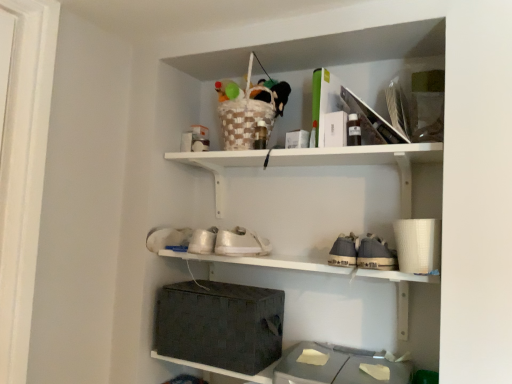
Question: Does white matte shoe at lower left, which is the 2th shoe from right to left, appear on the right side of woven fabric basket at center, which appears as the 1th shelf when ordered from the bottom?

Choices:
 (A) no
 (B) yes

Answer: (A)

Question: Could you tell me if white matte shoe at lower left, the first shoe in the left-to-right sequence, is turned towards woven fabric basket at center, which appears as the 1th shelf when ordered from the bottom?

Choices:
 (A) no
 (B) yes

Answer: (A)

Question: Can you confirm if white matte shoe at lower left, which is the 2th shoe from right to left, is smaller than woven fabric basket at center, which ranks as the 2th shelf in top-to-bottom order?

Choices:
 (A) no
 (B) yes

Answer: (B)

Question: Does white matte shoe at lower left, the first shoe in the left-to-right sequence, touch woven fabric basket at center, which appears as the 1th shelf when ordered from the bottom?

Choices:
 (A) yes
 (B) no

Answer: (B)

Question: From a real-world perspective, is white matte shoe at lower left, which is the 2th shoe from right to left, on woven fabric basket at center, which ranks as the 2th shelf in top-to-bottom order?

Choices:
 (A) no
 (B) yes

Answer: (B)

Question: Does white matte shoe at lower left, which is the 2th shoe from right to left, have a lesser width compared to woven fabric basket at center, which appears as the 1th shelf when ordered from the bottom?

Choices:
 (A) no
 (B) yes

Answer: (A)

Question: Can you confirm if woven fabric storage box at lower center, positioned as the first storage box in left-to-right order, is shorter than white matte shoe at lower left, which is the 2th shoe from right to left?

Choices:
 (A) no
 (B) yes

Answer: (A)

Question: Considering the relative sizes of woven fabric storage box at lower center, positioned as the first storage box in left-to-right order, and white matte shoe at lower left, the first shoe in the left-to-right sequence, in the image provided, is woven fabric storage box at lower center, positioned as the first storage box in left-to-right order, bigger than white matte shoe at lower left, the first shoe in the left-to-right sequence,?

Choices:
 (A) yes
 (B) no

Answer: (A)

Question: Is woven fabric storage box at lower center, the 2th storage box in the right-to-left sequence, in contact with white matte shoe at lower left, the first shoe in the left-to-right sequence?

Choices:
 (A) no
 (B) yes

Answer: (A)

Question: Considering the relative sizes of woven fabric storage box at lower center, the 2th storage box in the right-to-left sequence, and white matte shoe at lower left, the first shoe in the left-to-right sequence, in the image provided, is woven fabric storage box at lower center, the 2th storage box in the right-to-left sequence, thinner than white matte shoe at lower left, the first shoe in the left-to-right sequence,?

Choices:
 (A) yes
 (B) no

Answer: (B)

Question: Is woven fabric storage box at lower center, positioned as the first storage box in left-to-right order, to the left of white matte shoe at lower left, the first shoe in the left-to-right sequence, from the viewer's perspective?

Choices:
 (A) yes
 (B) no

Answer: (B)

Question: Can you confirm if woven fabric storage box at lower center, the 2th storage box in the right-to-left sequence, is taller than white matte shoe at lower left, which is the 2th shoe from right to left?

Choices:
 (A) yes
 (B) no

Answer: (A)

Question: Considering the relative sizes of white matte shelf at upper center, the first shelf positioned from the top, and white matte shoe at lower left, which is the 2th shoe from right to left, in the image provided, is white matte shelf at upper center, the first shelf positioned from the top, shorter than white matte shoe at lower left, which is the 2th shoe from right to left,?

Choices:
 (A) no
 (B) yes

Answer: (A)